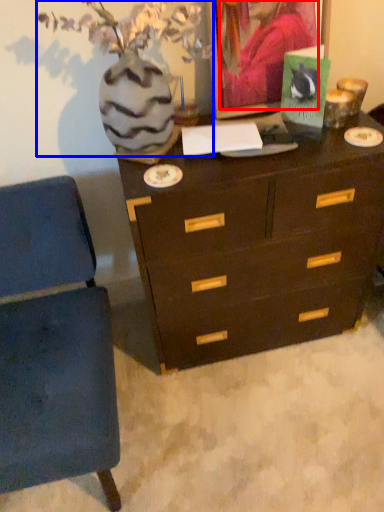
Question: Among these objects, which one is nearest to the camera, person (highlighted by a red box) or floral arrangement (highlighted by a blue box)?

Choices:
 (A) person
 (B) floral arrangement

Answer: (B)